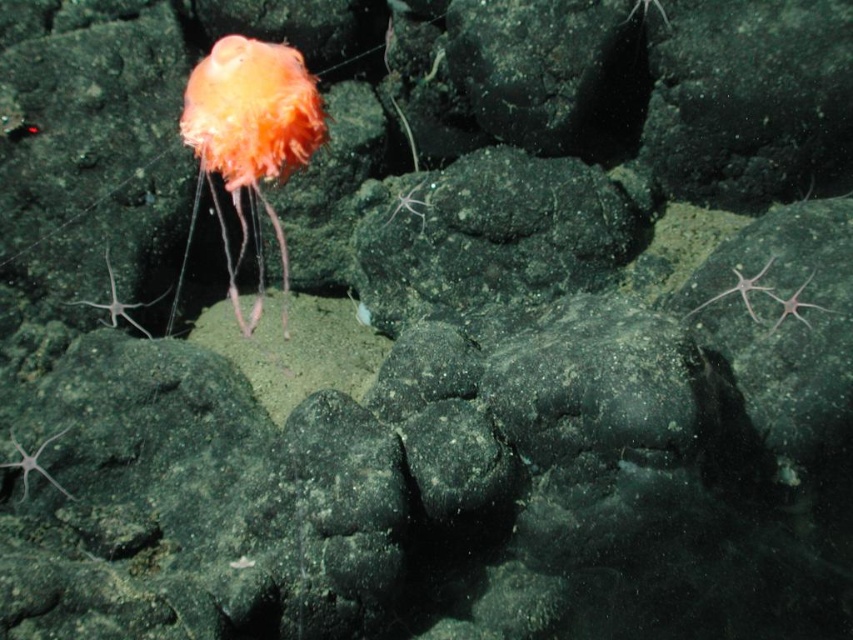
Question: Estimate the real-world distances between objects in this image. Which object is closer to the orange soft jellyfish at upper left?

Choices:
 (A) translucent white starfish at lower right
 (B) translucent white starfish at right

Answer: (B)

Question: Which of the following is the closest to the observer?

Choices:
 (A) translucent white starfish at right
 (B) orange soft jellyfish at upper left
 (C) translucent white starfish at lower right

Answer: (C)

Question: Can you confirm if translucent white starfish at right is smaller than translucent white starfish at lower right?

Choices:
 (A) yes
 (B) no

Answer: (B)

Question: Is orange soft jellyfish at upper left thinner than translucent white starfish at right?

Choices:
 (A) yes
 (B) no

Answer: (B)

Question: Does translucent white starfish at right have a greater width compared to translucent white starfish at lower right?

Choices:
 (A) no
 (B) yes

Answer: (B)

Question: Which of the following is the closest to the observer?

Choices:
 (A) (807, 307)
 (B) (254, 205)

Answer: (A)